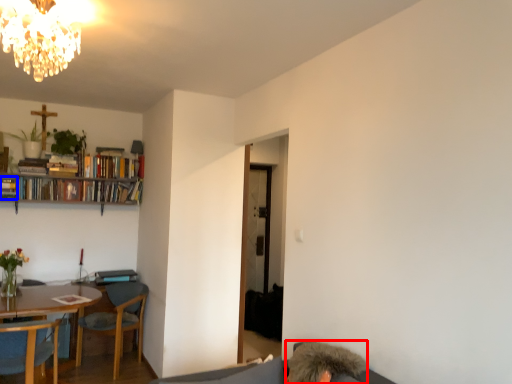
Question: Which point is closer to the camera, person (highlighted by a red box) or book (highlighted by a blue box)?

Choices:
 (A) person
 (B) book

Answer: (A)